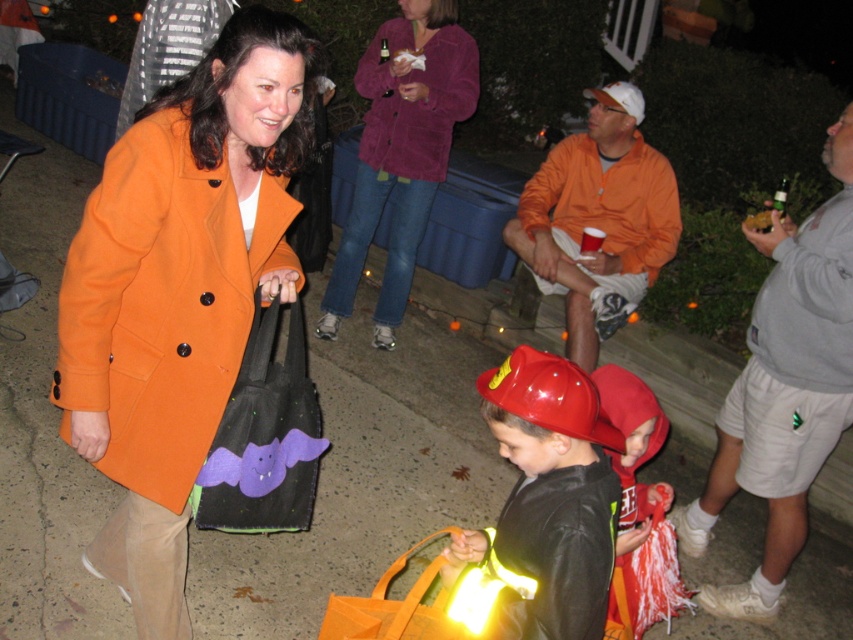
Question: Considering the relative positions of purple corduroy sweater at upper center and black felt bag with bat design at center in the image provided, where is purple corduroy sweater at upper center located with respect to black felt bag with bat design at center?

Choices:
 (A) below
 (B) above

Answer: (B)

Question: Which of the following is the farthest from the observer?

Choices:
 (A) (402, 116)
 (B) (538, 493)
 (C) (670, 536)

Answer: (A)

Question: Can you confirm if black felt bag with bat design at center is wider than red matte fire helmet at center?

Choices:
 (A) no
 (B) yes

Answer: (A)

Question: Can you confirm if black felt bag with bat design at center is positioned to the left of red matte fire helmet at center?

Choices:
 (A) yes
 (B) no

Answer: (A)

Question: Which of the following is the closest to the observer?

Choices:
 (A) (253, 440)
 (B) (399, 289)
 (C) (135, 422)
 (D) (440, 141)

Answer: (C)

Question: Which of the following is the farthest from the observer?

Choices:
 (A) reflective plastic fire helmet at center
 (B) black felt bag with bat design at center
 (C) velvet purple coat at center
 (D) red matte fire helmet at center

Answer: (C)